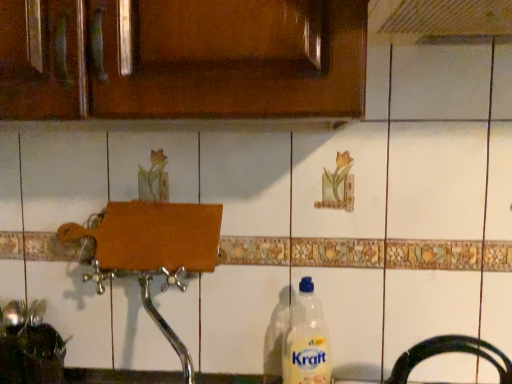
Measure the distance between translucent plastic bottle at lower center and camera.

The distance of translucent plastic bottle at lower center from camera is 32.93 inches.

The height and width of the screenshot is (384, 512). What are the coordinates of `translucent plastic bottle at lower center` in the screenshot? It's located at (306, 340).

What is the approximate height of translucent plastic bottle at lower center?

→ It is 11.60 inches.

What do you see at coordinates (306, 340) in the screenshot? The width and height of the screenshot is (512, 384). I see `translucent plastic bottle at lower center` at bounding box center [306, 340].

Describe the element at coordinates (185, 60) in the screenshot. I see `brown wood cabinet at upper center` at that location.

The image size is (512, 384). Find the location of `brown wood cabinet at upper center`. brown wood cabinet at upper center is located at coordinates (185, 60).

I want to click on translucent plastic bottle at lower center, so click(x=306, y=340).

Considering the relative positions of translucent plastic bottle at lower center and brown wood cabinet at upper center in the image provided, is translucent plastic bottle at lower center to the left of brown wood cabinet at upper center from the viewer's perspective?

In fact, translucent plastic bottle at lower center is to the right of brown wood cabinet at upper center.

Considering the positions of objects translucent plastic bottle at lower center and brown wood cabinet at upper center in the image provided, who is in front, translucent plastic bottle at lower center or brown wood cabinet at upper center?

brown wood cabinet at upper center is in front.

Is point (328, 344) farther from camera compared to point (338, 46)?

Yes, it is behind point (338, 46).

From the image's perspective, between translucent plastic bottle at lower center and brown wood cabinet at upper center, who is located below?

translucent plastic bottle at lower center appears lower in the image.

From a real-world perspective, between translucent plastic bottle at lower center and brown wood cabinet at upper center, who is vertically lower?

From a 3D spatial view, translucent plastic bottle at lower center is below.

In terms of width, does translucent plastic bottle at lower center look wider or thinner when compared to brown wood cabinet at upper center?

Considering their sizes, translucent plastic bottle at lower center looks slimmer than brown wood cabinet at upper center.

Which of these two, translucent plastic bottle at lower center or brown wood cabinet at upper center, stands taller?

translucent plastic bottle at lower center is taller.

Consider the image. Looking at the image, does translucent plastic bottle at lower center seem bigger or smaller compared to brown wood cabinet at upper center?

In the image, translucent plastic bottle at lower center appears to be smaller than brown wood cabinet at upper center.

Can we say translucent plastic bottle at lower center lies outside brown wood cabinet at upper center?

translucent plastic bottle at lower center lies outside brown wood cabinet at upper center's area.

From the picture: Is translucent plastic bottle at lower center touching brown wood cabinet at upper center?

No.

Is translucent plastic bottle at lower center aimed at brown wood cabinet at upper center?

No, translucent plastic bottle at lower center is not oriented towards brown wood cabinet at upper center.

In the scene shown: Measure the distance between translucent plastic bottle at lower center and brown wood cabinet at upper center.

A distance of 20.76 inches exists between translucent plastic bottle at lower center and brown wood cabinet at upper center.

Identify the location of bottle below the brown wood cabinet at upper center (from a real-world perspective). (306, 340).

In the image, is brown wood cabinet at upper center on the left side or the right side of translucent plastic bottle at lower center?

From the image, it's evident that brown wood cabinet at upper center is to the left of translucent plastic bottle at lower center.

Is the depth of brown wood cabinet at upper center greater than that of translucent plastic bottle at lower center?

No, it is not.

Does point (60, 14) lie in front of point (321, 313)?

Yes, point (60, 14) is in front of point (321, 313).

From the image's perspective, is brown wood cabinet at upper center above or below translucent plastic bottle at lower center?

brown wood cabinet at upper center is above translucent plastic bottle at lower center.

From a real-world perspective, relative to translucent plastic bottle at lower center, is brown wood cabinet at upper center vertically above or below?

brown wood cabinet at upper center is above translucent plastic bottle at lower center.

Is brown wood cabinet at upper center wider than translucent plastic bottle at lower center?

Yes, brown wood cabinet at upper center is wider than translucent plastic bottle at lower center.

Considering the sizes of objects brown wood cabinet at upper center and translucent plastic bottle at lower center in the image provided, who is taller, brown wood cabinet at upper center or translucent plastic bottle at lower center?

With more height is translucent plastic bottle at lower center.

Considering the sizes of objects brown wood cabinet at upper center and translucent plastic bottle at lower center in the image provided, who is smaller, brown wood cabinet at upper center or translucent plastic bottle at lower center?

translucent plastic bottle at lower center.

Can we say brown wood cabinet at upper center lies outside translucent plastic bottle at lower center?

brown wood cabinet at upper center is positioned outside translucent plastic bottle at lower center.

Is there a large distance between brown wood cabinet at upper center and translucent plastic bottle at lower center?

No, brown wood cabinet at upper center is not far from translucent plastic bottle at lower center.

Is translucent plastic bottle at lower center at the back of brown wood cabinet at upper center?

No, brown wood cabinet at upper center is not facing away from translucent plastic bottle at lower center.

Can you tell me how much brown wood cabinet at upper center and translucent plastic bottle at lower center differ in facing direction?

0.68 degrees.

The height and width of the screenshot is (384, 512). What are the coordinates of `bottle lying behind the brown wood cabinet at upper center` in the screenshot? It's located at (306, 340).

The image size is (512, 384). I want to click on cabinetry above the translucent plastic bottle at lower center (from the image's perspective), so click(x=185, y=60).

Find the location of a particular element. bottle below the brown wood cabinet at upper center (from the image's perspective) is located at coordinates (306, 340).